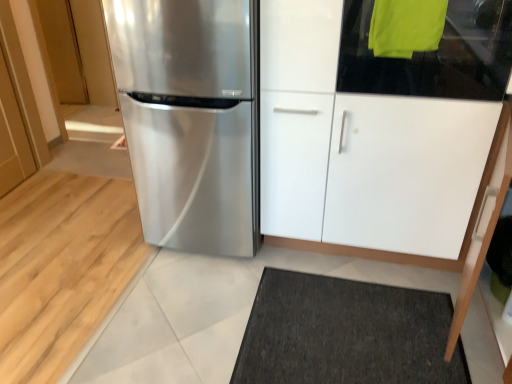
The width and height of the screenshot is (512, 384). What do you see at coordinates (361, 148) in the screenshot?
I see `white glossy cabinet at center` at bounding box center [361, 148].

This screenshot has height=384, width=512. What do you see at coordinates (191, 119) in the screenshot? I see `satin metallic refrigerator at center` at bounding box center [191, 119].

The height and width of the screenshot is (384, 512). Find the location of `white glossy cabinet at center`. white glossy cabinet at center is located at coordinates (361, 148).

Is white glossy cabinet at center wider or thinner than satin metallic refrigerator at center?

Considering their sizes, white glossy cabinet at center looks broader than satin metallic refrigerator at center.

In the image, there is a white glossy cabinet at center. Where is `refrigerator below it (from the image's perspective)`? Image resolution: width=512 pixels, height=384 pixels. refrigerator below it (from the image's perspective) is located at coordinates pyautogui.click(x=191, y=119).

From the image's perspective, is white glossy cabinet at center on top of satin metallic refrigerator at center?

Yes, from the image's perspective, white glossy cabinet at center is on top of satin metallic refrigerator at center.

Would you say satin metallic refrigerator at center is outside white glossy cabinet at center?

Answer: No, satin metallic refrigerator at center is not outside of white glossy cabinet at center.

Can you confirm if satin metallic refrigerator at center is shorter than white glossy cabinet at center?

Yes.

From the image's perspective, is satin metallic refrigerator at center located above white glossy cabinet at center?

No, from the image's perspective, satin metallic refrigerator at center is not above white glossy cabinet at center.

Between transparent glass door at upper right and white glossy cabinet at center, which one appears on the left side from the viewer's perspective?

white glossy cabinet at center is more to the left.

At what (x,y) coordinates should I click in order to perform the action: click on cabinetry on the left of transparent glass door at upper right. Please return your answer as a coordinate pair (x, y). Looking at the image, I should click on (361, 148).

How much distance is there between transparent glass door at upper right and white glossy cabinet at center?

A distance of 10.17 inches exists between transparent glass door at upper right and white glossy cabinet at center.

What's the angular difference between transparent glass door at upper right and white glossy cabinet at center's facing directions?

They differ by 0.00018 degrees in their facing directions.

Locate an element on the screen. glass door above the satin metallic refrigerator at center (from the image's perspective) is located at coordinates (433, 55).

Is transparent glass door at upper right bigger than satin metallic refrigerator at center?

Actually, transparent glass door at upper right might be smaller than satin metallic refrigerator at center.

How many degrees apart are the facing directions of transparent glass door at upper right and satin metallic refrigerator at center?

transparent glass door at upper right and satin metallic refrigerator at center are facing 0.00028 degrees away from each other.

From the image's perspective, is transparent glass door at upper right below satin metallic refrigerator at center?

Actually, transparent glass door at upper right appears above satin metallic refrigerator at center in the image.

Between satin metallic refrigerator at center and transparent glass door at upper right, which one has larger size?

satin metallic refrigerator at center.

How much distance is there between satin metallic refrigerator at center and transparent glass door at upper right?

satin metallic refrigerator at center is 28.48 inches from transparent glass door at upper right.

From the image's perspective, is satin metallic refrigerator at center on transparent glass door at upper right?

Actually, satin metallic refrigerator at center appears below transparent glass door at upper right in the image.

Based on the photo, is satin metallic refrigerator at center shorter than transparent glass door at upper right?

No.

From a real-world perspective, is white glossy cabinet at center on transparent glass door at upper right?

No, from a real-world perspective, white glossy cabinet at center is not over transparent glass door at upper right

Which object is thinner, white glossy cabinet at center or transparent glass door at upper right?

transparent glass door at upper right is thinner.

From the image's perspective, is white glossy cabinet at center on top of transparent glass door at upper right?

No, from the image's perspective, white glossy cabinet at center is not above transparent glass door at upper right.

How many degrees apart are the facing directions of white glossy cabinet at center and transparent glass door at upper right?

The angular difference between white glossy cabinet at center and transparent glass door at upper right is 0.00018 degrees.

Where is `refrigerator to the left of white glossy cabinet at center`? refrigerator to the left of white glossy cabinet at center is located at coordinates (191, 119).

Identify the location of refrigerator that appears above the white glossy cabinet at center (from a real-world perspective). (191, 119).

When comparing their distances from transparent glass door at upper right, does satin metallic refrigerator at center or white glossy cabinet at center seem further?

satin metallic refrigerator at center lies further to transparent glass door at upper right than the other object.

From the picture: Estimate the real-world distances between objects in this image. Which object is further from satin metallic refrigerator at center, transparent glass door at upper right or white glossy cabinet at center?

transparent glass door at upper right.

Based on the photo, looking at the image, which one is located further to transparent glass door at upper right, white glossy cabinet at center or satin metallic refrigerator at center?

Based on the image, satin metallic refrigerator at center appears to be further to transparent glass door at upper right.

Based on their spatial positions, is white glossy cabinet at center or transparent glass door at upper right closer to satin metallic refrigerator at center?

Based on the image, white glossy cabinet at center appears to be nearer to satin metallic refrigerator at center.

Based on their spatial positions, is transparent glass door at upper right or satin metallic refrigerator at center closer to white glossy cabinet at center?

Based on the image, transparent glass door at upper right appears to be nearer to white glossy cabinet at center.

Estimate the real-world distances between objects in this image. Which object is closer to white glossy cabinet at center, satin metallic refrigerator at center or transparent glass door at upper right?

transparent glass door at upper right is positioned closer to the anchor white glossy cabinet at center.

The height and width of the screenshot is (384, 512). Find the location of `cabinetry between satin metallic refrigerator at center and transparent glass door at upper right in the horizontal direction`. cabinetry between satin metallic refrigerator at center and transparent glass door at upper right in the horizontal direction is located at coordinates (361, 148).